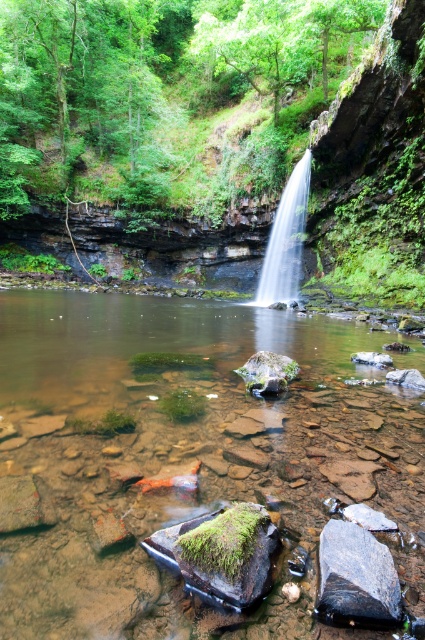
Question: Is clear stone stream at center below clear water at center?

Choices:
 (A) yes
 (B) no

Answer: (A)

Question: Can you confirm if clear stone stream at center is wider than clear water at center?

Choices:
 (A) yes
 (B) no

Answer: (A)

Question: Does clear stone stream at center have a lesser width compared to clear water at center?

Choices:
 (A) no
 (B) yes

Answer: (A)

Question: Which point is closer to the camera?

Choices:
 (A) clear stone stream at center
 (B) clear water at center

Answer: (A)